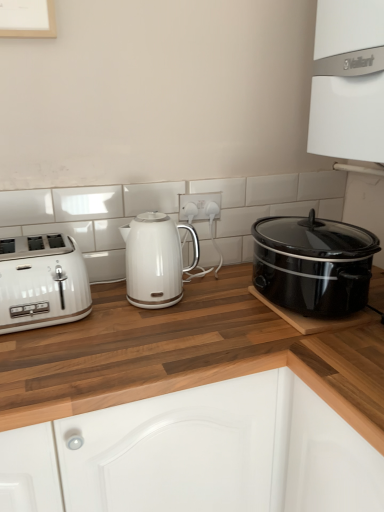
Question: Is point (208, 194) closer or farther from the camera than point (26, 247)?

Choices:
 (A) closer
 (B) farther

Answer: (B)

Question: Is white plastic electric outlet at center inside the boundaries of white glossy toaster at left, or outside?

Choices:
 (A) outside
 (B) inside

Answer: (A)

Question: Estimate the real-world distances between objects in this image. Which object is closer to the white plastic electric outlet at center?

Choices:
 (A) white glossy kettle at center
 (B) black glossy slow cooker at right
 (C) white glossy vaillant boiler at upper right
 (D) white glossy toaster at left
 (E) wooden at left

Answer: (A)

Question: Which of these objects is positioned farthest from the white glossy kettle at center?

Choices:
 (A) white glossy vaillant boiler at upper right
 (B) white glossy toaster at left
 (C) wooden at left
 (D) black glossy slow cooker at right
 (E) white plastic electric outlet at center

Answer: (A)